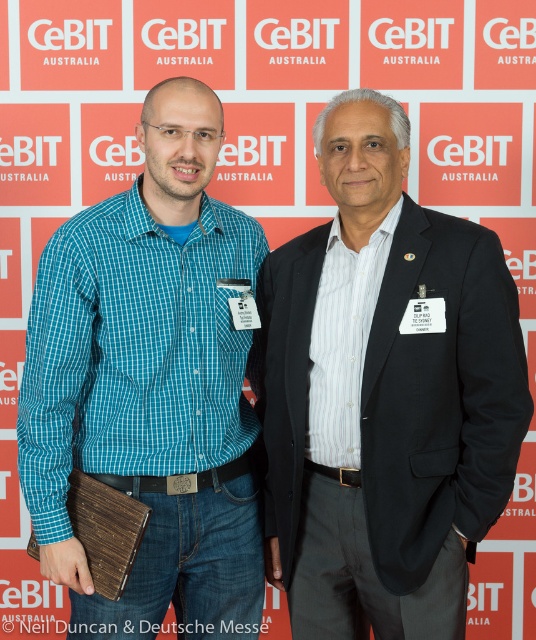
Between dark gray suit at center and teal checkered shirt at center, which one has more height?

With more height is teal checkered shirt at center.

Which is below, dark gray suit at center or teal checkered shirt at center?

dark gray suit at center is lower down.

Is point (516, 460) positioned in front of point (222, 449)?

Yes, it is in front of point (222, 449).

Find the location of `dark gray suit at center`. dark gray suit at center is located at coordinates (384, 394).